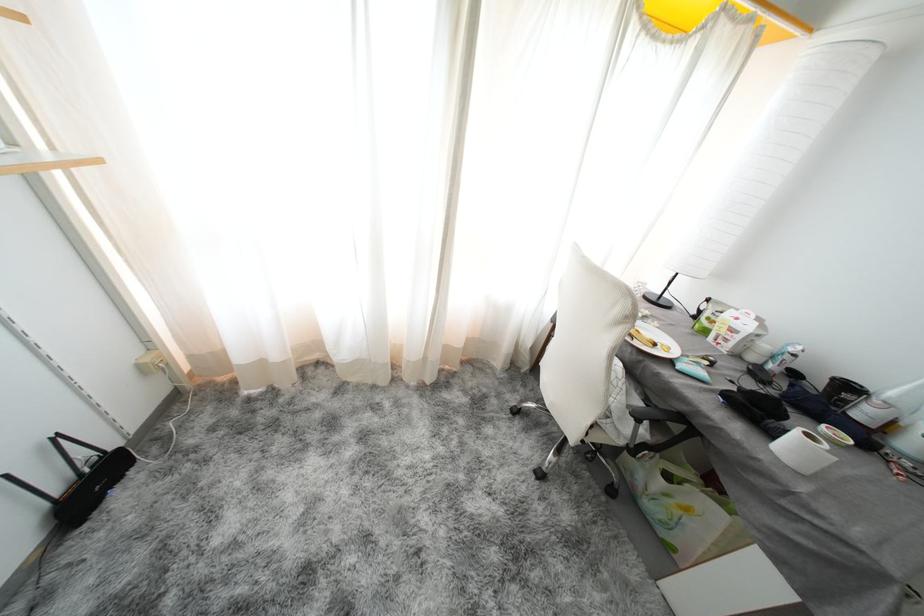
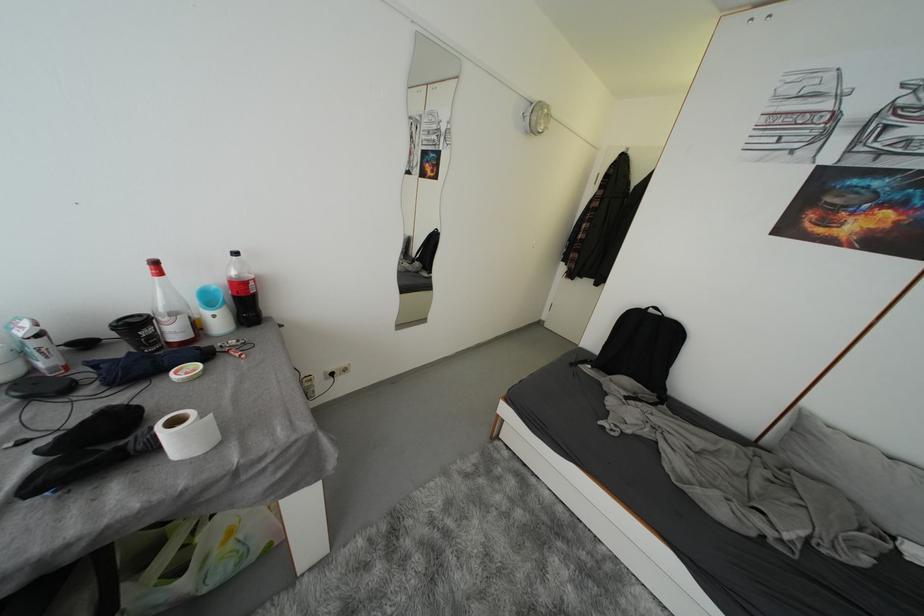
Locate, in the second image, the point that corresponds to point 835,456 in the first image.

(208, 419)